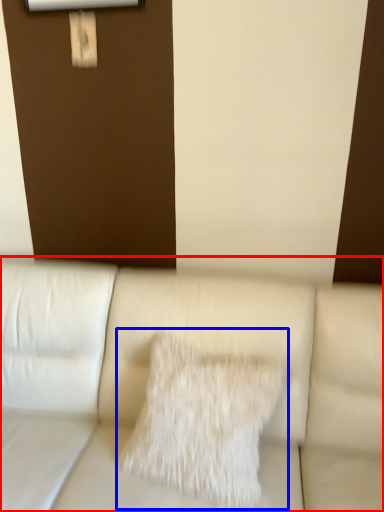
Question: Which object is further to the camera taking this photo, studio couch (highlighted by a red box) or pillow (highlighted by a blue box)?

Choices:
 (A) studio couch
 (B) pillow

Answer: (B)